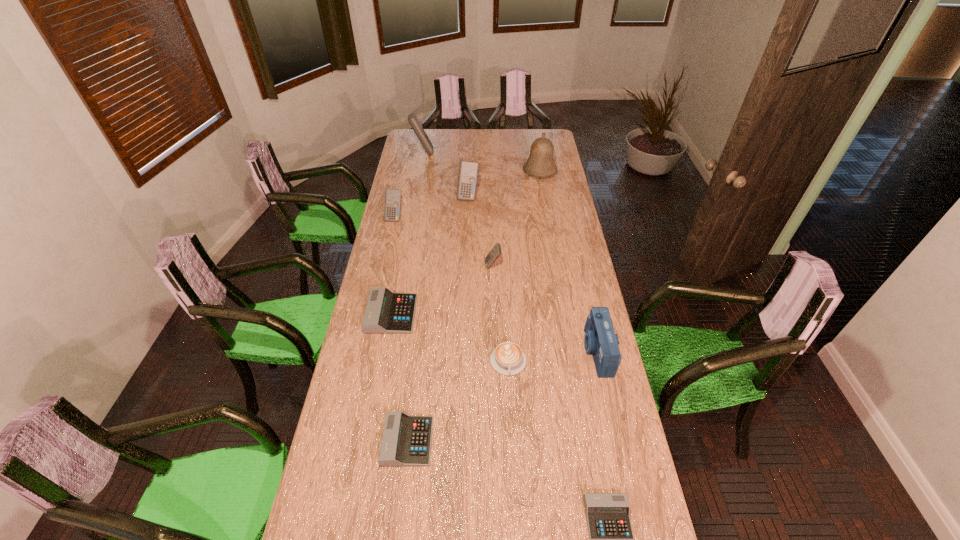
Locate an element on the screen. camera that is at the right edge is located at coordinates (600, 341).

Locate an element on the screen. Image resolution: width=960 pixels, height=540 pixels. object present at the far left corner is located at coordinates (412, 118).

Identify the location of vacant space at the far edge of the desktop. (450, 147).

Where is `vacant area at the left edge of the desktop`? The image size is (960, 540). vacant area at the left edge of the desktop is located at coordinates (415, 215).

This screenshot has height=540, width=960. Find the location of `free location at the right edge of the desktop`. free location at the right edge of the desktop is located at coordinates (637, 505).

This screenshot has width=960, height=540. In order to click on unoccupied position between the second shortest calculator and the eighth shortest object in this screenshot , I will do `click(438, 319)`.

Find the location of a particular element. vacant area that lies between the eighth nearest object and the second nearest gray calculator is located at coordinates (438, 319).

Image resolution: width=960 pixels, height=540 pixels. Find the location of `free space between the cappuccino and the sixth calculator from left to right`. free space between the cappuccino and the sixth calculator from left to right is located at coordinates (500, 314).

At what (x,y) coordinates should I click in order to perform the action: click on free point between the third tallest object and the second nearest gray calculator. Please return your answer as a coordinate pair (x, y). The width and height of the screenshot is (960, 540). Looking at the image, I should click on (438, 319).

Where is `vacant area between the third shortest calculator and the cappuccino`? vacant area between the third shortest calculator and the cappuccino is located at coordinates (450, 338).